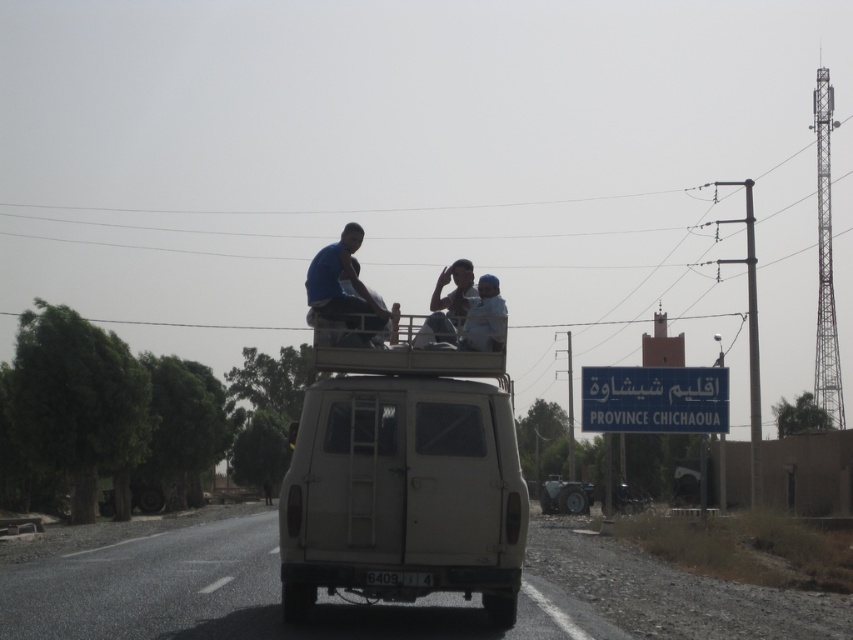
You are a photographer trying to capture the van and its passengers. The blue fabric shirt at center and the light blue fabric at center are both visible in your frame. Which fabric should you focus on to ensure it fits entirely within your camera lens, considering their widths?

The blue fabric shirt at center might be wider than light blue fabric at center, so focusing on the light blue fabric at center would be safer to ensure it fits entirely within the camera lens.

You are a pedestrian standing on the rural road and see the beige van with two passengers. You notice the blue fabric shirt at center and the light blue fabric at center on the roof rack. Which of these two items is higher up?

The blue fabric shirt at center is much taller than the light blue fabric at center, so the blue fabric shirt at center is higher up.

You are a traveler who needs to read the sign for directions. The metallic rectangular sign at center has important information. Can you read it easily from where you are standing, considering the size of the light blue fabric at center might block your view?

The metallic rectangular sign at center is larger than the light blue fabric at center, so it should be readable despite any potential obstruction from the fabric.